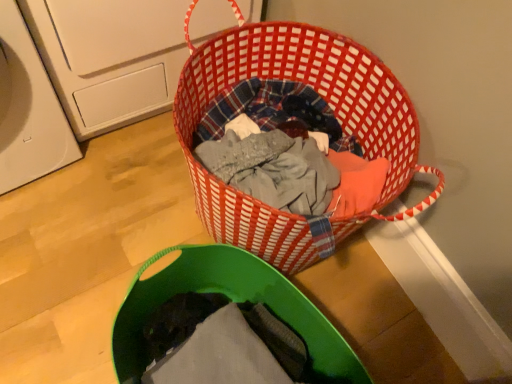
Question: Does white plastic washing machine at left have a greater width compared to red woven basket at center?

Choices:
 (A) no
 (B) yes

Answer: (B)

Question: Is white plastic washing machine at left far away from red woven basket at center?

Choices:
 (A) yes
 (B) no

Answer: (B)

Question: Does white plastic washing machine at left have a larger size compared to red woven basket at center?

Choices:
 (A) yes
 (B) no

Answer: (A)

Question: Is white plastic washing machine at left shorter than red woven basket at center?

Choices:
 (A) yes
 (B) no

Answer: (B)

Question: Is white plastic washing machine at left facing away from red woven basket at center?

Choices:
 (A) yes
 (B) no

Answer: (B)

Question: Is red woven basket at center taller or shorter than white plastic washing machine at left?

Choices:
 (A) short
 (B) tall

Answer: (A)

Question: From the image's perspective, is red woven basket at center above or below white plastic washing machine at left?

Choices:
 (A) above
 (B) below

Answer: (B)

Question: Is red woven basket at center in front of or behind white plastic washing machine at left in the image?

Choices:
 (A) behind
 (B) front

Answer: (B)

Question: Considering the positions of point (373, 56) and point (140, 84), is point (373, 56) closer or farther from the camera than point (140, 84)?

Choices:
 (A) farther
 (B) closer

Answer: (B)

Question: Considering their positions, is white plastic washing machine at left located in front of or behind green fabric laundry basket at lower center?

Choices:
 (A) behind
 (B) front

Answer: (A)

Question: Considering the positions of point (177, 36) and point (296, 306), is point (177, 36) closer or farther from the camera than point (296, 306)?

Choices:
 (A) closer
 (B) farther

Answer: (B)

Question: In terms of width, does white plastic washing machine at left look wider or thinner when compared to green fabric laundry basket at lower center?

Choices:
 (A) thin
 (B) wide

Answer: (B)

Question: Is white plastic washing machine at left bigger or smaller than green fabric laundry basket at lower center?

Choices:
 (A) small
 (B) big

Answer: (B)

Question: From a real-world perspective, relative to red woven basket at center, is green fabric laundry basket at lower center vertically above or below?

Choices:
 (A) above
 (B) below

Answer: (A)

Question: Is green fabric laundry basket at lower center wider or thinner than red woven basket at center?

Choices:
 (A) wide
 (B) thin

Answer: (B)